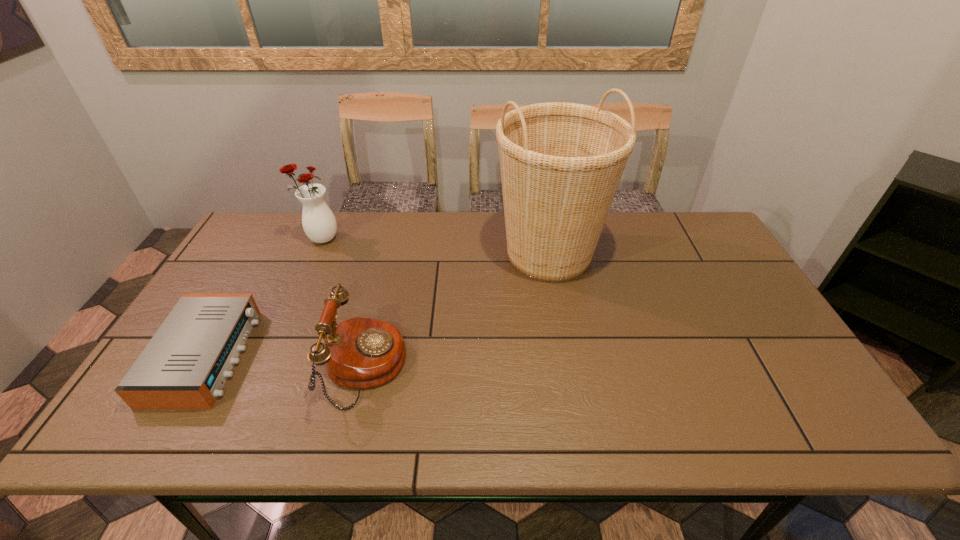
This screenshot has width=960, height=540. In order to click on the tallest object in this screenshot , I will do `click(561, 163)`.

Where is `the rightmost object`? The image size is (960, 540). the rightmost object is located at coordinates (561, 163).

Locate an element on the screen. vase is located at coordinates (318, 221).

Where is `the second shortest object`? The height and width of the screenshot is (540, 960). the second shortest object is located at coordinates (360, 353).

Locate an element on the screen. The height and width of the screenshot is (540, 960). the third object from left to right is located at coordinates (360, 353).

Identify the location of the shortest object. Image resolution: width=960 pixels, height=540 pixels. (185, 365).

What are the coordinates of `vacant space positioned 0.320m on the right of the rightmost object` in the screenshot? It's located at (707, 254).

Locate an element on the screen. The image size is (960, 540). vacant position located on the right of the vase is located at coordinates (437, 239).

This screenshot has height=540, width=960. Identify the location of free point located 0.110m on the dial of the third object from left to right. tap(450, 367).

You are a GUI agent. You are given a task and a screenshot of the screen. Output one action in this format:
    pyautogui.click(x=<x>, y=<y>)
    Task: Click on the free space located 0.080m on the control panel of the shortest object
    Image resolution: width=960 pixels, height=540 pixels.
    Given the screenshot: What is the action you would take?
    tap(276, 356)